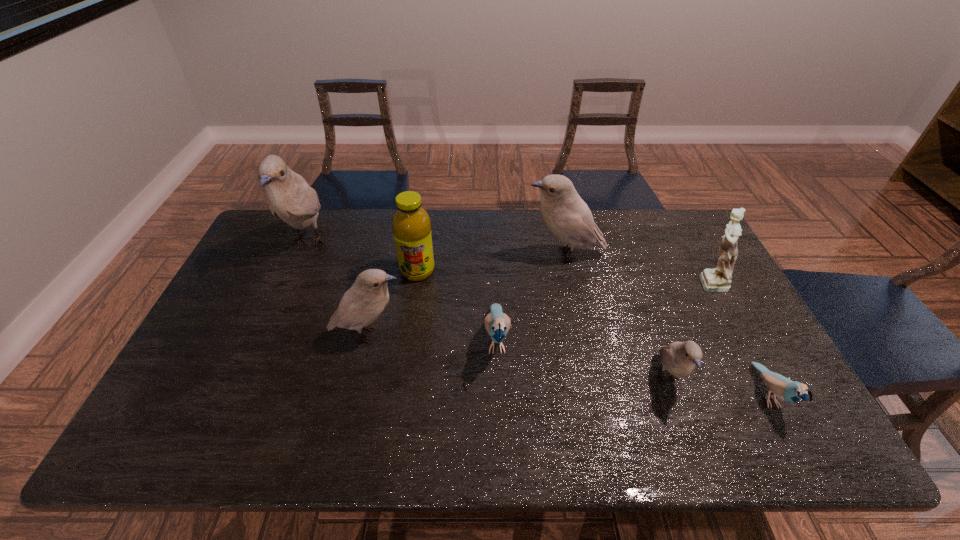
This screenshot has height=540, width=960. I want to click on the fourth object from left to right, so click(x=497, y=323).

Locate an element on the screen. the bigger blue bird is located at coordinates (497, 323).

Image resolution: width=960 pixels, height=540 pixels. Find the location of `the right blue bird`. the right blue bird is located at coordinates (790, 391).

In order to click on the shortest bird in this screenshot , I will do `click(790, 391)`.

Locate an element on the screen. The image size is (960, 540). vacant space situated 0.380m at the beak of the tallest object is located at coordinates (250, 377).

The image size is (960, 540). In order to click on vacant space located 0.210m at the beak of the fourth object from right to left in this screenshot , I will do `click(461, 254)`.

This screenshot has height=540, width=960. What are the coordinates of `vacant space located 0.050m at the beak of the fourth object from right to left` in the screenshot? It's located at (509, 254).

Find the location of a particular element. The width and height of the screenshot is (960, 540). vacant space located 0.090m at the beak of the fourth object from right to left is located at coordinates (497, 254).

This screenshot has width=960, height=540. In order to click on vacant space located on the front-facing side of the figurine in this screenshot , I will do `click(581, 282)`.

You are a GUI agent. You are given a task and a screenshot of the screen. Output one action in this format:
    pyautogui.click(x=<x>, y=<y>)
    Task: Click on the free location located 0.380m on the front-facing side of the figurine
    
    Given the screenshot: What is the action you would take?
    pyautogui.click(x=567, y=282)